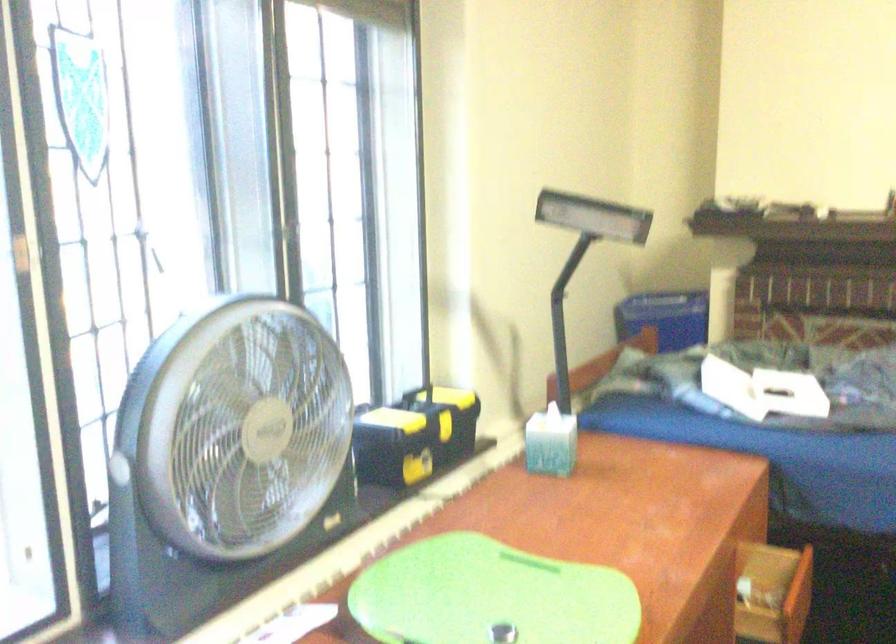
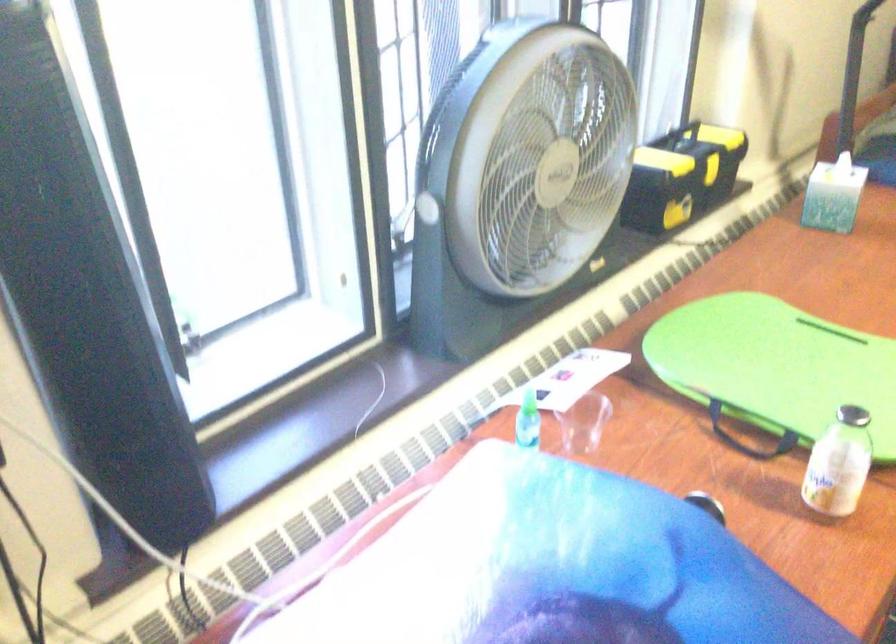
Question: Based on the continuous images, in which direction is the camera rotating? Reply with the corresponding letter.

Choices:
 (A) Left
 (B) Right
 (C) Up
 (D) Down

Answer: (D)